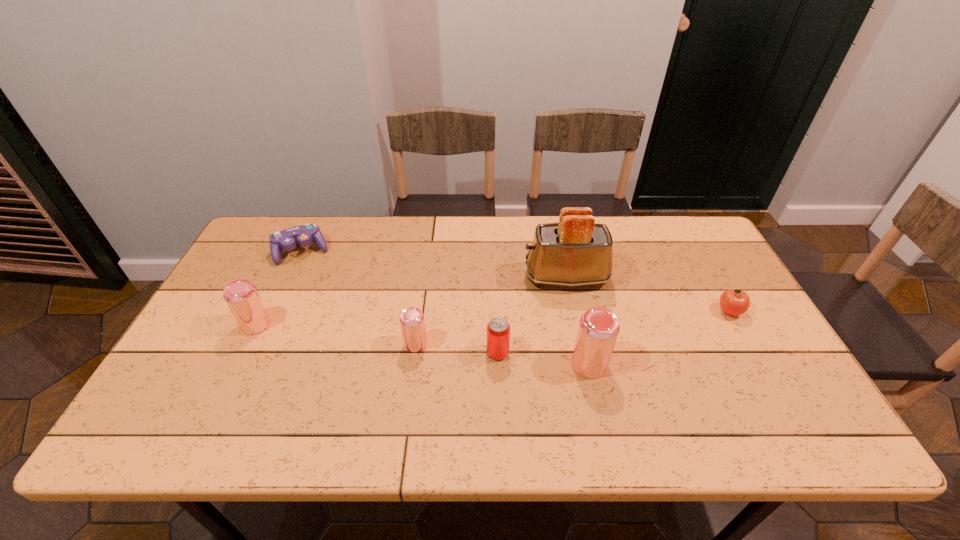
The image size is (960, 540). In the image, there is a desktop. In order to click on vacant space at the near left corner in this screenshot , I will do `click(204, 386)`.

In the image, there is a desktop. Identify the location of vacant space at the far right corner. This screenshot has width=960, height=540. (710, 254).

Locate an element on the screen. This screenshot has width=960, height=540. vacant space at the near right corner of the desktop is located at coordinates (797, 404).

Identify the location of free space between the fourth object from right to left and the control. Image resolution: width=960 pixels, height=540 pixels. (399, 302).

What are the coordinates of `vacant area that lies between the sixth shortest object and the can` in the screenshot? It's located at (543, 359).

Image resolution: width=960 pixels, height=540 pixels. I want to click on vacant area that lies between the can and the tallest object, so click(532, 315).

The image size is (960, 540). Find the location of `vacant area that lies between the shortest beer can and the toaster`. vacant area that lies between the shortest beer can and the toaster is located at coordinates (491, 310).

I want to click on free area in between the rightmost beer can and the toaster, so pyautogui.click(x=578, y=321).

Locate an element on the screen. The image size is (960, 540). vacant space in between the tallest object and the third object from left to right is located at coordinates (491, 310).

Locate an element on the screen. free space between the shortest beer can and the fourth object from right to left is located at coordinates (457, 348).